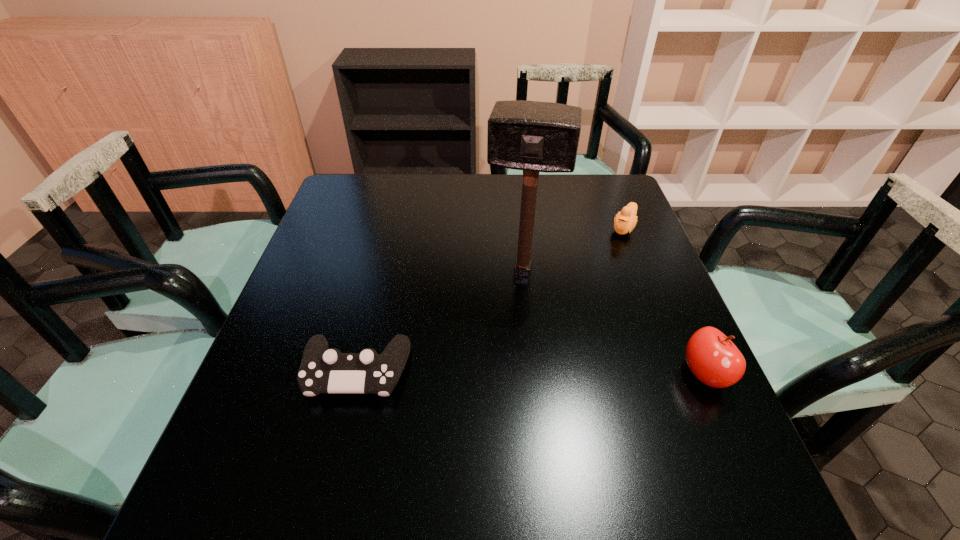
This screenshot has width=960, height=540. Identify the location of blank area located on the face of the duckling. (588, 298).

The height and width of the screenshot is (540, 960). I want to click on object present at the left edge, so click(322, 370).

Identify the location of apple that is at the right edge. Image resolution: width=960 pixels, height=540 pixels. (712, 357).

Image resolution: width=960 pixels, height=540 pixels. I want to click on duckling positioned at the right edge, so click(x=625, y=221).

At what (x,y) coordinates should I click in order to perform the action: click on vacant space at the far edge. Please return your answer as a coordinate pair (x, y). The width and height of the screenshot is (960, 540). Looking at the image, I should click on (444, 176).

Identify the location of free space at the near edge. (413, 421).

In order to click on vacant area at the left edge of the desktop in this screenshot , I will do `click(350, 281)`.

What are the coordinates of `blank space at the right edge of the desktop` in the screenshot? It's located at (638, 320).

In the image, there is a desktop. Where is `free space at the far left corner`? The height and width of the screenshot is (540, 960). free space at the far left corner is located at coordinates (353, 196).

This screenshot has width=960, height=540. Find the location of `vacant space at the far right corner of the desktop`. vacant space at the far right corner of the desktop is located at coordinates (602, 210).